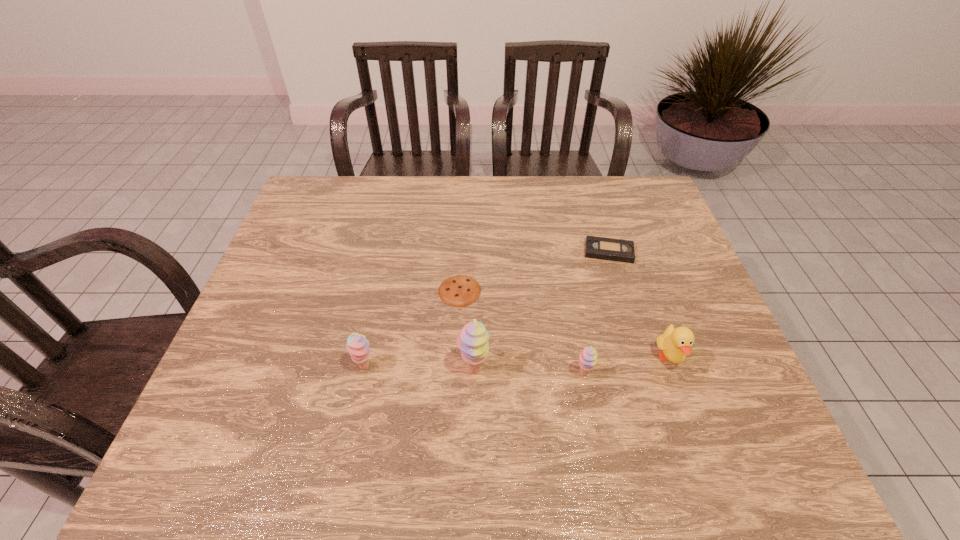
The width and height of the screenshot is (960, 540). In the image, there is a desktop. Find the location of `vacant space at the far edge`. vacant space at the far edge is located at coordinates (599, 188).

What are the coordinates of `vacant space at the near edge of the desktop` in the screenshot? It's located at [x=599, y=402].

In the image, there is a desktop. Identify the location of vacant space at the left edge. The width and height of the screenshot is (960, 540). coord(292,353).

The height and width of the screenshot is (540, 960). Find the location of `vacant space at the right edge of the desktop`. vacant space at the right edge of the desktop is located at coordinates (628, 233).

Locate an element on the screen. The height and width of the screenshot is (540, 960). free spot at the far left corner of the desktop is located at coordinates (329, 191).

I want to click on free space at the near left corner of the desktop, so click(x=241, y=411).

Where is `vacant region between the shortest object and the third object from right to left`? vacant region between the shortest object and the third object from right to left is located at coordinates (521, 332).

Find the location of a particular element. unoccupied position between the rightmost sherbert and the second sherbert from left to right is located at coordinates (528, 372).

Locate an element on the screen. vacant space that is in between the fifth tallest object and the duckling is located at coordinates (639, 305).

You are a GUI agent. You are given a task and a screenshot of the screen. Output one action in this format:
    pyautogui.click(x=<x>, y=<y>)
    Task: Click on the unoccupied position between the farthest object and the rightmost sherbert
    This screenshot has width=960, height=540.
    Given the screenshot: What is the action you would take?
    pyautogui.click(x=596, y=313)